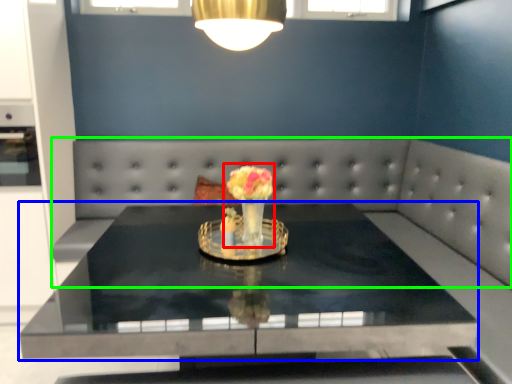
Question: Which object is positioned closest to floral arrangement (highlighted by a red box)? Select from table (highlighted by a blue box) and couch (highlighted by a green box).

Choices:
 (A) table
 (B) couch

Answer: (A)